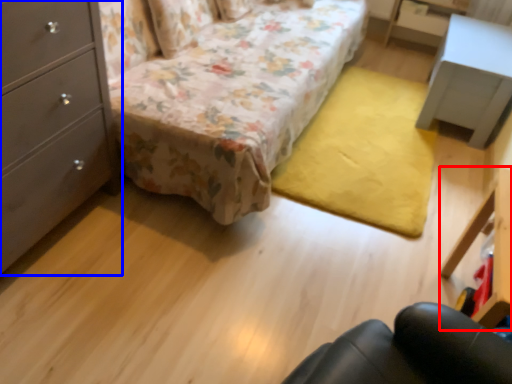
Question: Which of the following is the farthest to the observer, vanity (highlighted by a red box) or chest of drawers (highlighted by a blue box)?

Choices:
 (A) vanity
 (B) chest of drawers

Answer: (A)